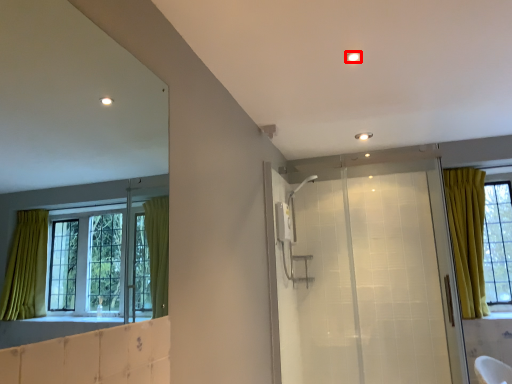
Question: From the image's perspective, what is the correct spatial positioning of light (annotated by the red box) in reference to screen door?

Choices:
 (A) above
 (B) below

Answer: (A)